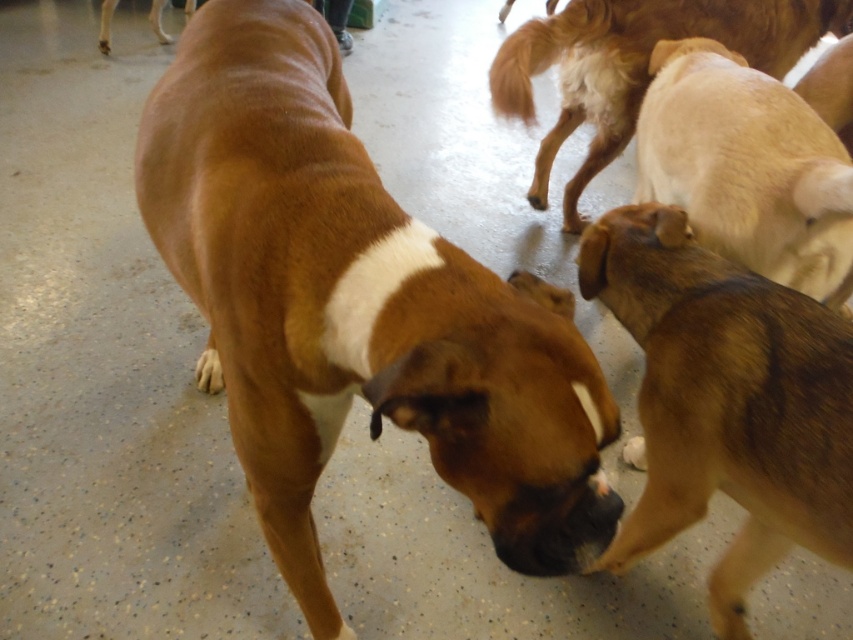
You are a dog trainer observing the scene. You notice a point marked at coordinates (x=753, y=161). Based on the description, what does this point indicate?

The point at (x=753, y=161) marks the location of the light brown fur at right.

You are standing at the entrance of the shelter and want to locate the light brown fur at center. According to the coordinates provided, in which quadrant of the image would you find it?

The light brown fur at center is located at coordinates point (635, 65), which places it in the lower left quadrant of the image.